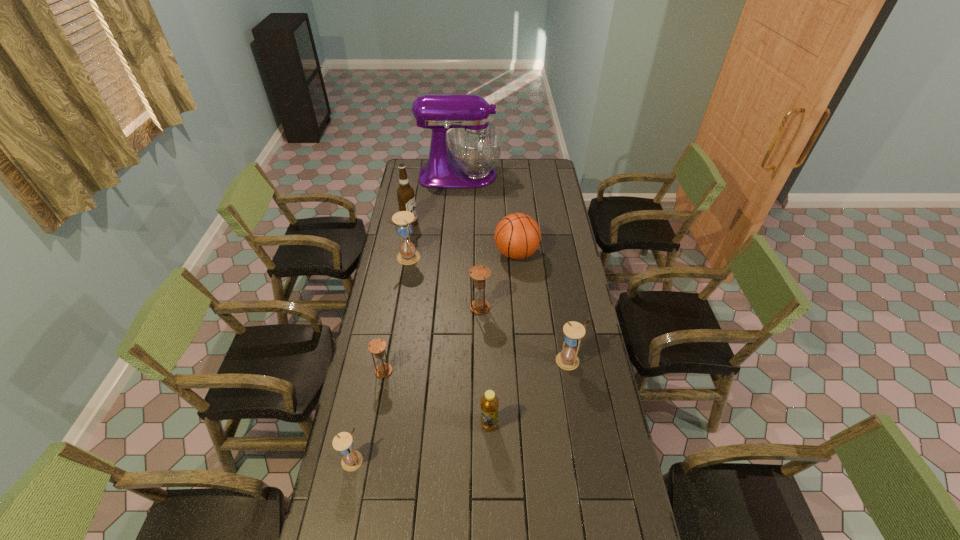
I want to click on vacant area that lies between the basketball and the farther brown hourglass, so click(x=498, y=281).

Choose which object is the fifth nearest neighbor to the farther brown hourglass. Please provide its 2D coordinates. Your answer should be formatted as a tuple, i.e. [(x, y)], where the tuple contains the x and y coordinates of a point satisfying the conditions above.

[(489, 403)]

Point out which object is positioned as the eighth nearest to the bottle. Please provide its 2D coordinates. Your answer should be formatted as a tuple, i.e. [(x, y)], where the tuple contains the x and y coordinates of a point satisfying the conditions above.

[(475, 144)]

This screenshot has height=540, width=960. Find the location of `hourglass that stands as the fourth closest to the eighth shortest object`. hourglass that stands as the fourth closest to the eighth shortest object is located at coordinates (567, 359).

Locate an element on the screen. This screenshot has width=960, height=540. the second closest hourglass to the second biggest white hourglass is located at coordinates (377, 346).

This screenshot has width=960, height=540. What are the coordinates of `the second closest white hourglass relative to the rightmost white hourglass` in the screenshot? It's located at (408, 255).

Select which white hourglass appears as the second closest to the farthest white hourglass. Please provide its 2D coordinates. Your answer should be formatted as a tuple, i.e. [(x, y)], where the tuple contains the x and y coordinates of a point satisfying the conditions above.

[(351, 460)]

At what (x,y) coordinates should I click in order to perform the action: click on vacant point that satisfies the following two spatial constraints: 1. on the back side of the smaller brown hourglass; 2. on the right side of the farthest white hourglass. Please return your answer as a coordinate pair (x, y). The height and width of the screenshot is (540, 960). Looking at the image, I should click on pyautogui.click(x=404, y=257).

Image resolution: width=960 pixels, height=540 pixels. I want to click on vacant region that satisfies the following two spatial constraints: 1. at the bowl opening of the farthest object; 2. on the back side of the bottle, so click(446, 424).

Where is `free spot that satisfies the following two spatial constraints: 1. on the back side of the basketball; 2. at the bowl opening of the mixer`? The width and height of the screenshot is (960, 540). free spot that satisfies the following two spatial constraints: 1. on the back side of the basketball; 2. at the bowl opening of the mixer is located at coordinates (510, 176).